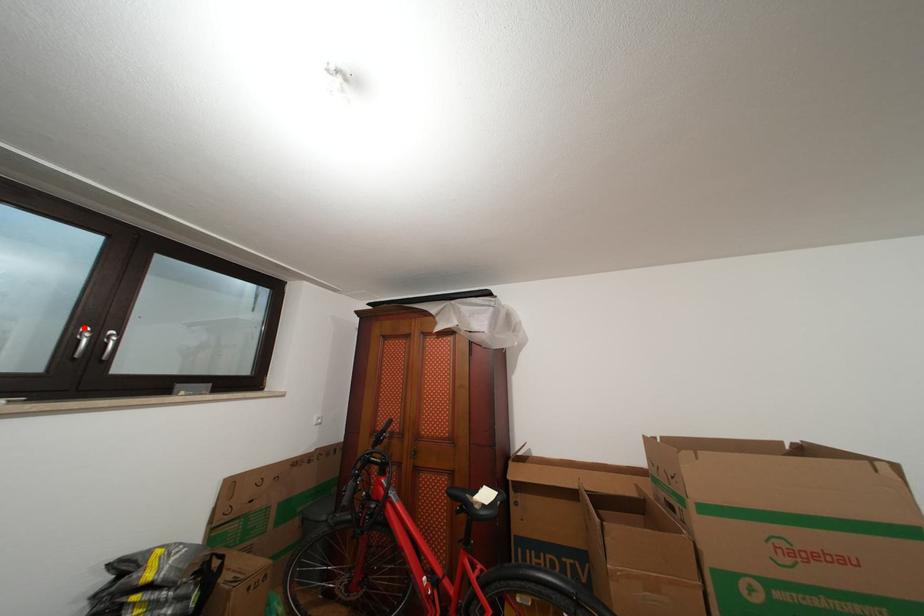
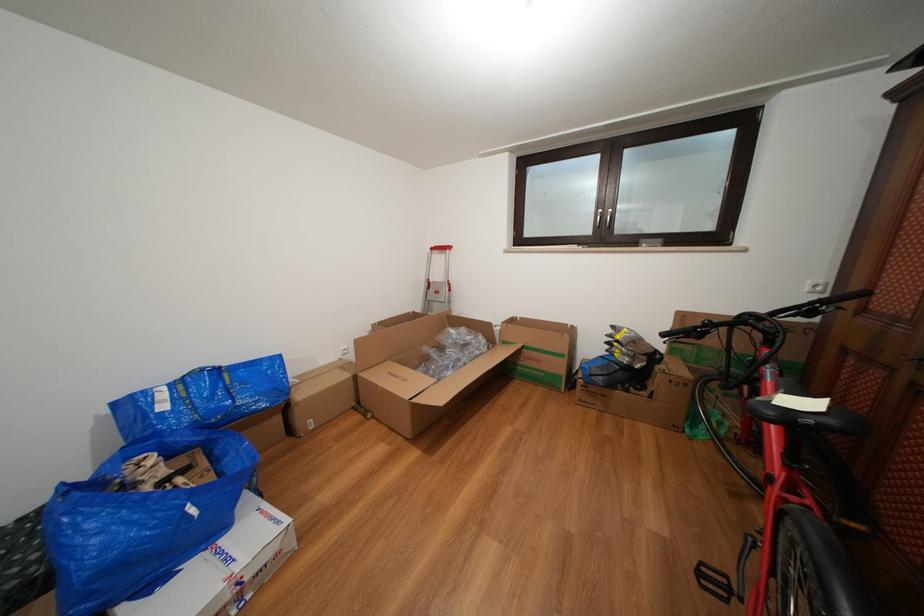
Find the pixel in the second image that matches the highlighted location in the first image.

(605, 214)